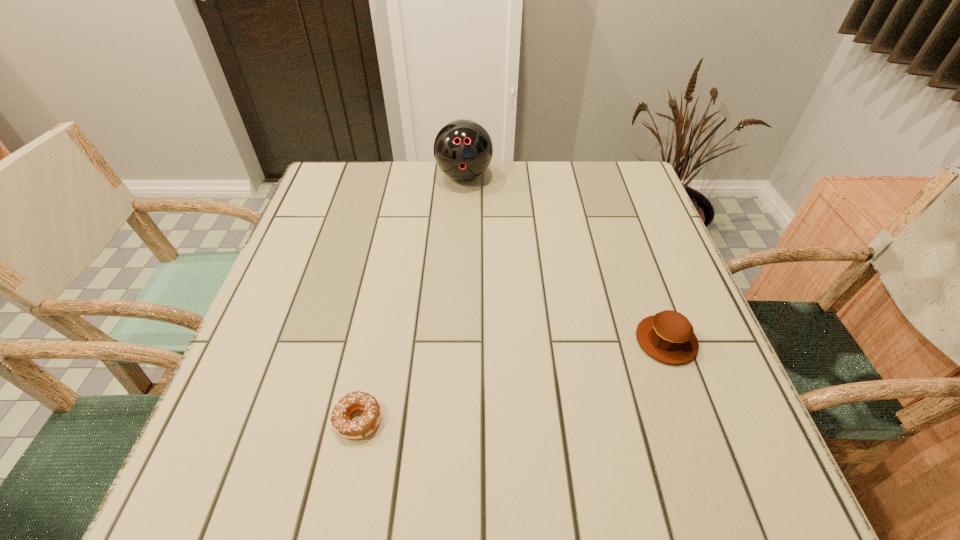
I want to click on free point between the doughnut and the muffin, so click(513, 380).

What are the coordinates of `vacant space that is in between the doughnut and the second shortest object` in the screenshot? It's located at (513, 380).

The height and width of the screenshot is (540, 960). In order to click on empty space that is in between the shortest object and the farthest object in this screenshot , I will do `click(411, 298)`.

Locate an element on the screen. The height and width of the screenshot is (540, 960). vacant space in between the second object from right to left and the muffin is located at coordinates (565, 258).

The height and width of the screenshot is (540, 960). I want to click on vacant area that lies between the rightmost object and the bowling ball, so click(x=565, y=258).

The image size is (960, 540). I want to click on unoccupied area between the farthest object and the second nearest object, so click(x=565, y=258).

Find the location of a particular element. This screenshot has height=540, width=960. the second closest object to the farthest object is located at coordinates (357, 400).

Image resolution: width=960 pixels, height=540 pixels. Find the location of `object that is the closest to the leftmost object`. object that is the closest to the leftmost object is located at coordinates (668, 336).

Identify the location of free space that satisfies the following two spatial constraints: 1. on the surface of the muffin near the finger holes; 2. on the right side of the second object from left to right. The height and width of the screenshot is (540, 960). (457, 341).

Find the location of a particular element. vacant space that satisfies the following two spatial constraints: 1. on the surface of the farthest object near the finger holes; 2. on the right side of the second shortest object is located at coordinates (457, 341).